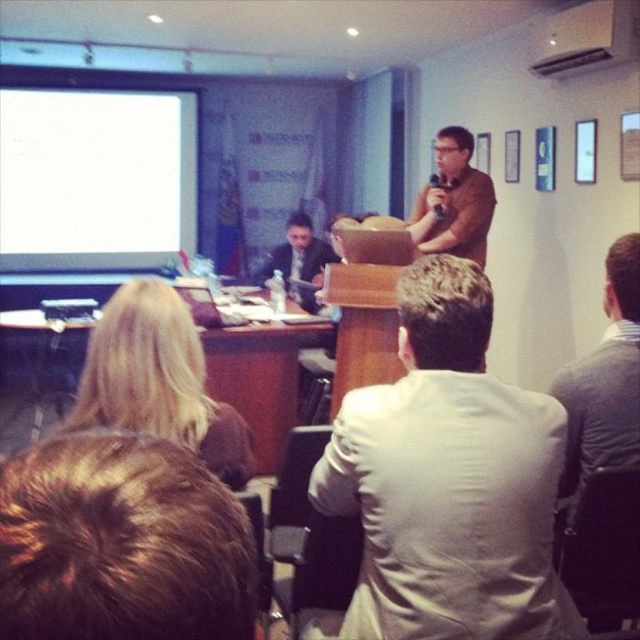
Question: Is the position of white matte projection screen at upper left more distant than that of blonde hair at upper left?

Choices:
 (A) no
 (B) yes

Answer: (B)

Question: Among these objects, which one is nearest to the camera?

Choices:
 (A) white matte projection screen at upper left
 (B) brown shirt at upper center
 (C) brown hair at lower left

Answer: (C)

Question: Is brown shirt at upper center below matte black suit at center?

Choices:
 (A) no
 (B) yes

Answer: (A)

Question: Which of the following is the farthest from the observer?

Choices:
 (A) (298, 234)
 (B) (60, 588)
 (C) (0, 227)

Answer: (C)

Question: Which of the following is the farthest from the observer?

Choices:
 (A) brown hair at lower left
 (B) brown shirt at upper center

Answer: (B)

Question: Where is brown shirt at upper center located in relation to matte black suit at center in the image?

Choices:
 (A) right
 (B) left

Answer: (A)